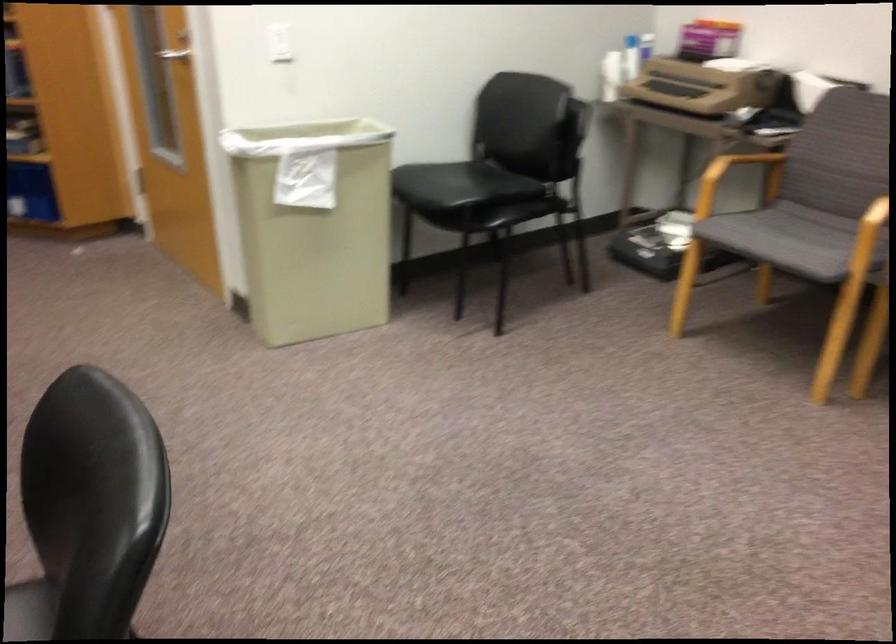
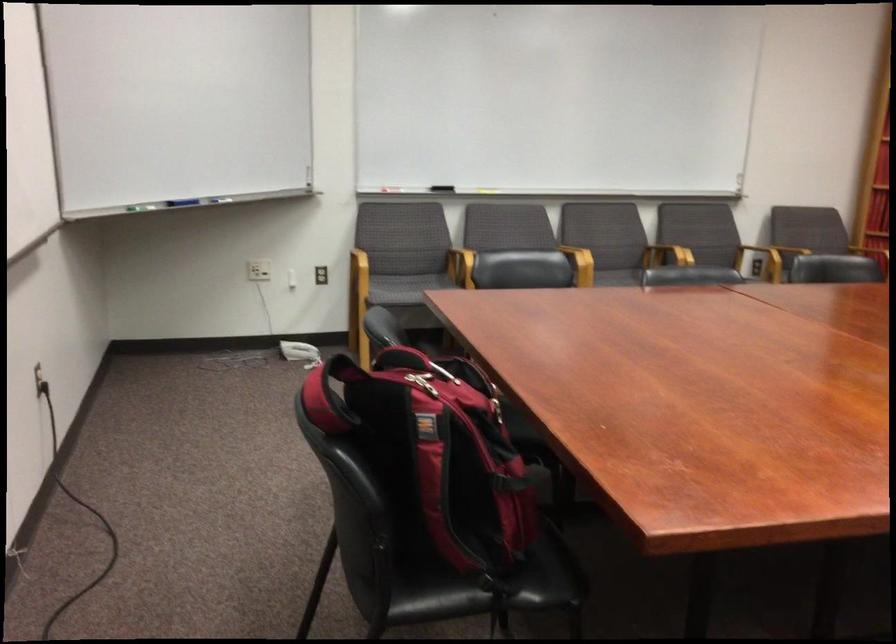
First-person continuous shooting, in which direction is the camera rotating?

The camera rotated toward left-down.